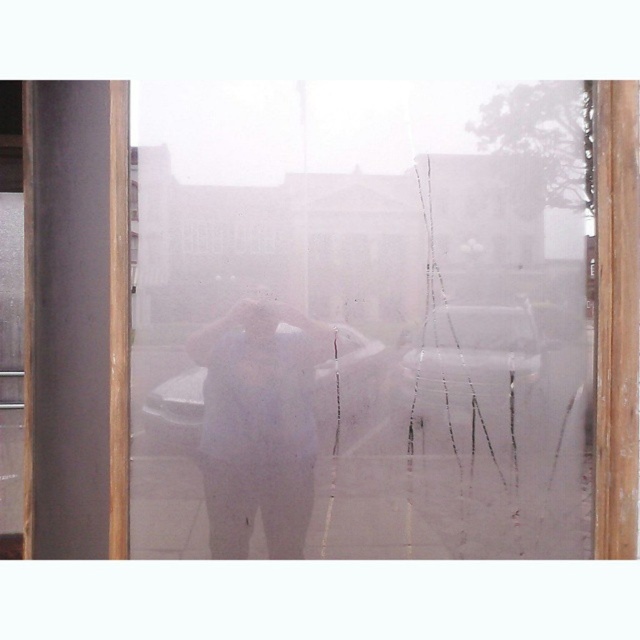
Is frosted glass door at center shorter than metallic silver car at center?

In fact, frosted glass door at center may be taller than metallic silver car at center.

Image resolution: width=640 pixels, height=640 pixels. What are the coordinates of `frosted glass door at center` in the screenshot? It's located at (360, 323).

Locate an element on the screen. This screenshot has height=640, width=640. frosted glass door at center is located at coordinates (360, 323).

Does metallic silver car at center appear under white matte car at center?

Correct, metallic silver car at center is located below white matte car at center.

From the picture: Is metallic silver car at center to the right of white matte car at center from the viewer's perspective?

Yes, metallic silver car at center is to the right of white matte car at center.

Who is more distant from viewer, (515, 397) or (285, 326)?

The point (285, 326) is more distant.

This screenshot has height=640, width=640. Identify the location of metallic silver car at center. (492, 364).

Is white matte shirt at center taller than metallic silver car at center?

Yes, white matte shirt at center is taller than metallic silver car at center.

Who is positioned more to the right, white matte shirt at center or metallic silver car at center?

From the viewer's perspective, metallic silver car at center appears more on the right side.

Does point (266, 508) come behind point (504, 417)?

Yes, it is.

This screenshot has height=640, width=640. Find the location of `white matte shirt at center`. white matte shirt at center is located at coordinates (259, 426).